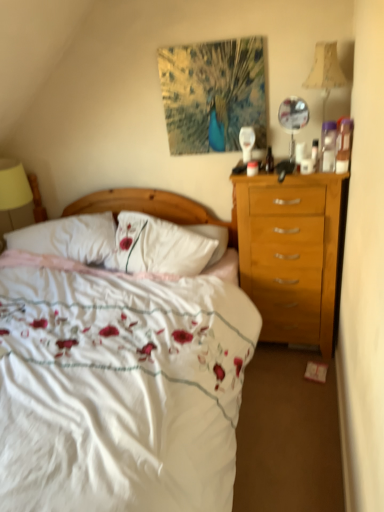
Question: Can you confirm if wooden headboard at center is wider than beige fabric lampshade at upper right?

Choices:
 (A) no
 (B) yes

Answer: (A)

Question: Is wooden headboard at center further to the viewer compared to beige fabric lampshade at upper right?

Choices:
 (A) no
 (B) yes

Answer: (B)

Question: From a real-world perspective, is wooden headboard at center positioned over beige fabric lampshade at upper right based on gravity?

Choices:
 (A) no
 (B) yes

Answer: (A)

Question: Does wooden headboard at center have a greater height compared to beige fabric lampshade at upper right?

Choices:
 (A) no
 (B) yes

Answer: (B)

Question: Does wooden headboard at center appear on the right side of beige fabric lampshade at upper right?

Choices:
 (A) no
 (B) yes

Answer: (A)

Question: Is beige fabric lampshade at upper right at the back of wooden headboard at center?

Choices:
 (A) no
 (B) yes

Answer: (A)

Question: Does beige fabric lampshade at upper right appear on the left side of white floral duvet at center?

Choices:
 (A) no
 (B) yes

Answer: (A)

Question: Can you confirm if beige fabric lampshade at upper right is positioned to the right of white floral duvet at center?

Choices:
 (A) yes
 (B) no

Answer: (A)

Question: From the image's perspective, would you say beige fabric lampshade at upper right is shown under white floral duvet at center?

Choices:
 (A) yes
 (B) no

Answer: (B)

Question: Is beige fabric lampshade at upper right facing towards white floral duvet at center?

Choices:
 (A) yes
 (B) no

Answer: (B)

Question: Does beige fabric lampshade at upper right have a lesser width compared to white floral duvet at center?

Choices:
 (A) yes
 (B) no

Answer: (A)

Question: Is beige fabric lampshade at upper right wider than white floral duvet at center?

Choices:
 (A) no
 (B) yes

Answer: (A)

Question: From a real-world perspective, does beige fabric lampshade at upper right sit lower than white soft pillow at center?

Choices:
 (A) no
 (B) yes

Answer: (A)